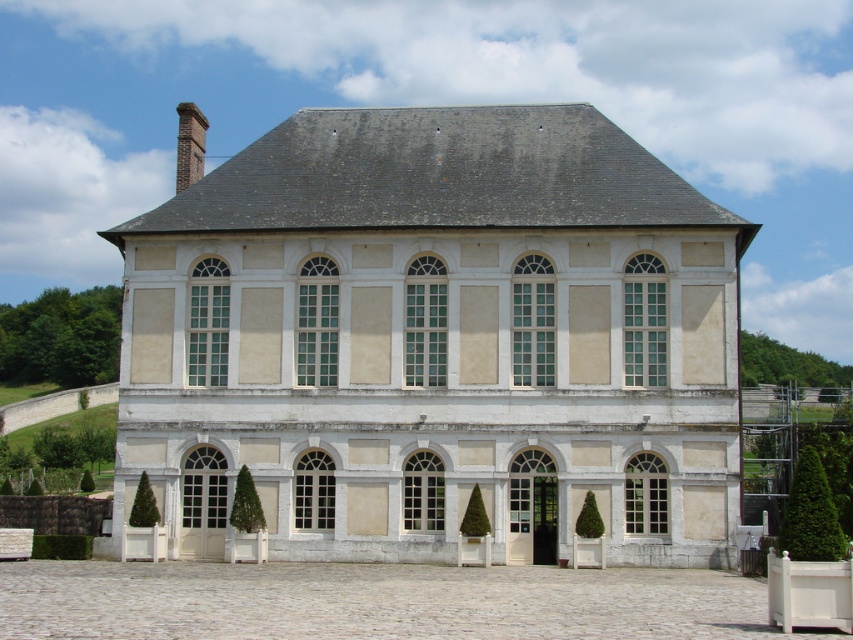
Does beige stone palace at center lie in front of brick chimney at upper left?

Yes, it is in front of brick chimney at upper left.

In the scene shown: Does beige stone palace at center appear on the left side of brick chimney at upper left?

Incorrect, beige stone palace at center is not on the left side of brick chimney at upper left.

Locate an element on the screen. The width and height of the screenshot is (853, 640). beige stone palace at center is located at coordinates (438, 340).